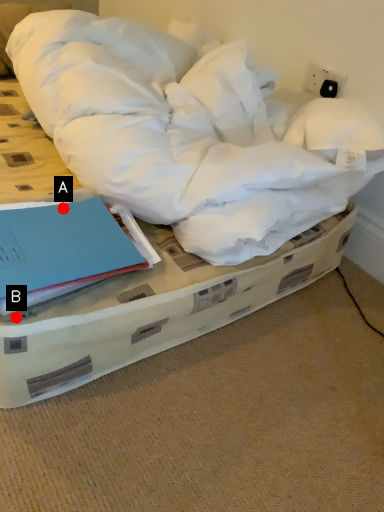
Question: Two points are circled on the image, labeled by A and B beside each circle. Which point is closer to the camera?

Choices:
 (A) A is closer
 (B) B is closer

Answer: (B)